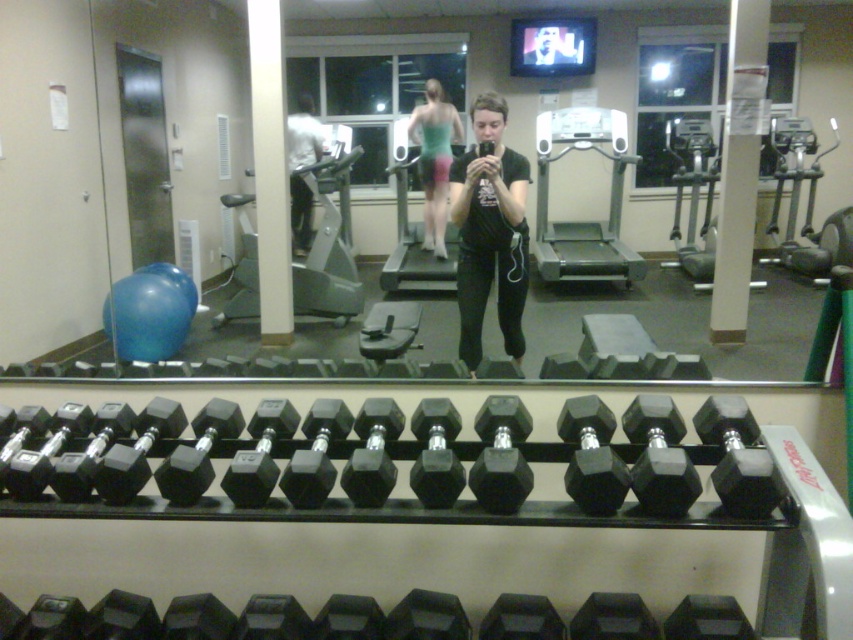
Question: Is black hexagonal dumbbell at center above matte white shirt at center?

Choices:
 (A) yes
 (B) no

Answer: (B)

Question: Which object is the farthest from the black hexagonal dumbbell at center?

Choices:
 (A) black rubber dumbbell at center
 (B) matte white shirt at center
 (C) black matte shirt at center

Answer: (B)

Question: Which object appears farthest from the camera in this image?

Choices:
 (A) black rubber dumbbell at center
 (B) gray rubber treadmill at center

Answer: (B)

Question: Can you confirm if gray rubber treadmill at center is smaller than matte white shirt at center?

Choices:
 (A) yes
 (B) no

Answer: (B)

Question: Can you confirm if black matte shirt at center is positioned to the right of gray rubber treadmill at center?

Choices:
 (A) no
 (B) yes

Answer: (A)

Question: Which point is closer to the camera taking this photo?

Choices:
 (A) (35, 608)
 (B) (566, 269)
 (C) (583, 480)
 (D) (476, 163)

Answer: (C)